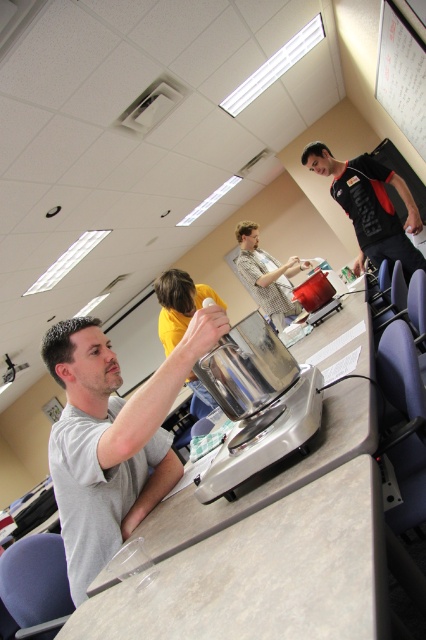
Question: Considering the real-world distances, which object is farthest from the checkered shirt at center?

Choices:
 (A) polished stainless steel food processor at center
 (B) yellow matte shirt at center

Answer: (A)

Question: Which object appears closest to the camera in this image?

Choices:
 (A) gray matte shirt at center
 (B) yellow matte shirt at center
 (C) black jersey at upper right
 (D) checkered shirt at center

Answer: (A)

Question: Is polished stainless steel food processor at center thinner than black jersey at upper right?

Choices:
 (A) yes
 (B) no

Answer: (A)

Question: In this image, where is polished stainless steel food processor at center located relative to yellow matte shirt at center?

Choices:
 (A) right
 (B) left

Answer: (A)

Question: Which point is closer to the camera?

Choices:
 (A) (377, 170)
 (B) (94, 444)
 (C) (397, 40)
 (D) (157, 292)

Answer: (B)

Question: Does black jersey at upper right have a smaller size compared to white paperboard at upper right?

Choices:
 (A) yes
 (B) no

Answer: (B)